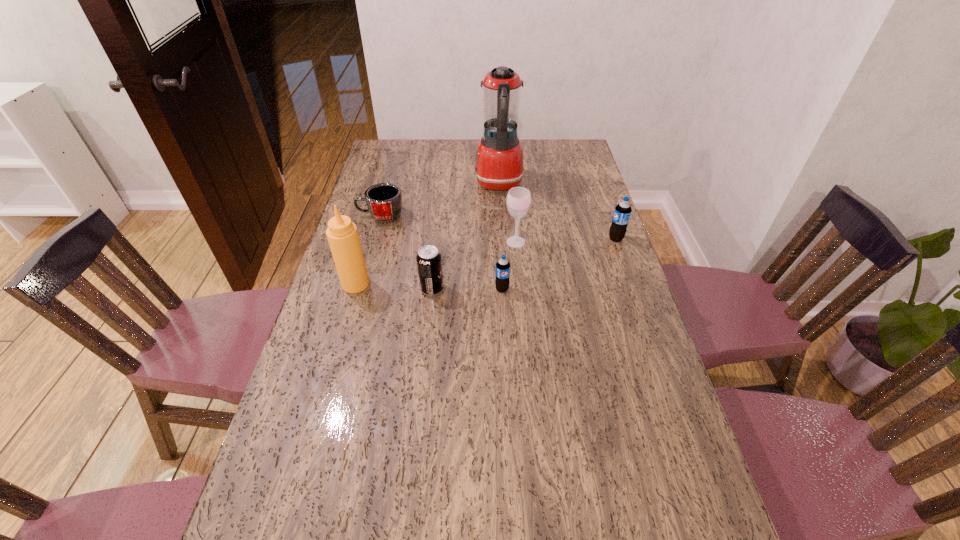
In the current image, all soda bottles are evenly spaced. To maintain this equal spacing, where should an additional soda bottle be placed on the left? Please point out a free spot. Please provide its 2D coordinates. Your answer should be formatted as a tuple, i.e. [(x, y)], where the tuple contains the x and y coordinates of a point satisfying the conditions above.

[(354, 355)]